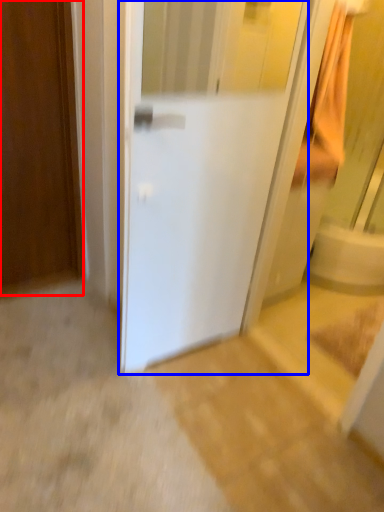
Question: Which point is closer to the camera, door (highlighted by a red box) or door (highlighted by a blue box)?

Choices:
 (A) door
 (B) door

Answer: (B)